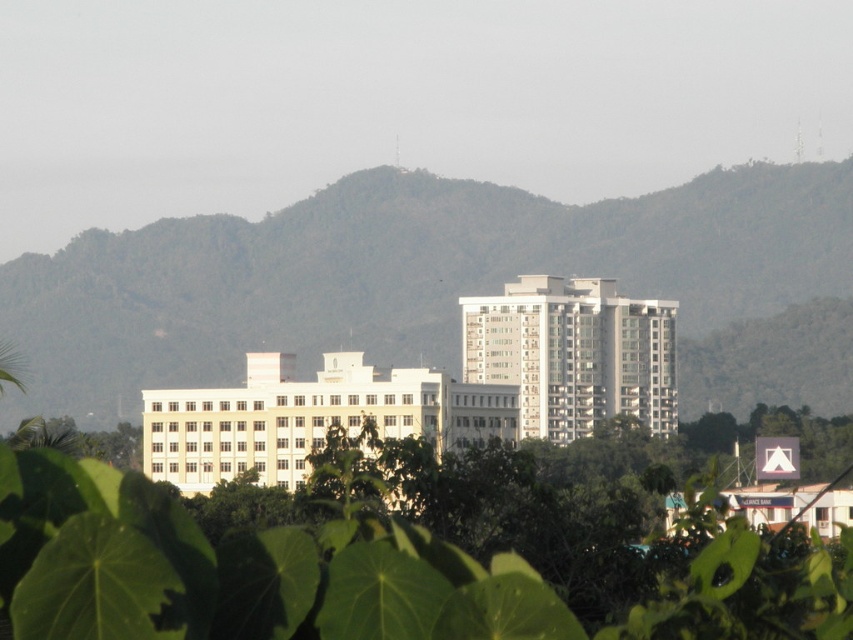
Question: Does green leafy mountain at center appear on the right side of green leafy tree at center?

Choices:
 (A) yes
 (B) no

Answer: (B)

Question: Which point is closer to the camera?

Choices:
 (A) (346, 310)
 (B) (553, 593)

Answer: (B)

Question: Does green leafy mountain at center lie in front of green leafy tree at center?

Choices:
 (A) yes
 (B) no

Answer: (B)

Question: Which point appears farthest from the camera in this image?

Choices:
 (A) (335, 237)
 (B) (265, 579)

Answer: (A)

Question: Does green leafy mountain at center have a smaller size compared to green leafy tree at center?

Choices:
 (A) yes
 (B) no

Answer: (A)